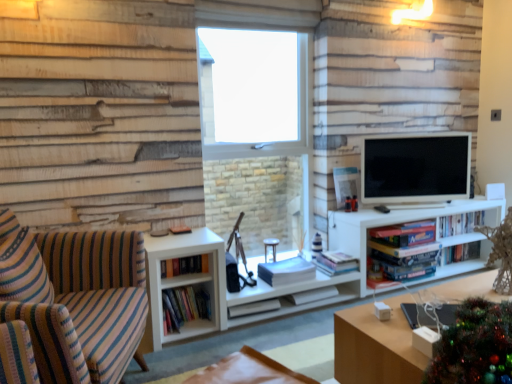
Question: Is hardcover books at center, which appears as the 1th book when viewed from the left, looking in the opposite direction of wooden table at lower right?

Choices:
 (A) yes
 (B) no

Answer: (B)

Question: Does hardcover books at center, which appears as the ninth book when viewed from the right, contain wooden table at lower right?

Choices:
 (A) yes
 (B) no

Answer: (B)

Question: Can you confirm if hardcover books at center, which appears as the ninth book when viewed from the right, is shorter than wooden table at lower right?

Choices:
 (A) no
 (B) yes

Answer: (B)

Question: From a real-world perspective, is hardcover books at center, which appears as the ninth book when viewed from the right, on wooden table at lower right?

Choices:
 (A) yes
 (B) no

Answer: (A)

Question: Can you confirm if hardcover books at center, which appears as the 1th book when viewed from the left, is taller than wooden table at lower right?

Choices:
 (A) no
 (B) yes

Answer: (A)

Question: Is hardcover books at center, which appears as the ninth book when viewed from the right, bigger than wooden table at lower right?

Choices:
 (A) yes
 (B) no

Answer: (B)

Question: Considering the relative sizes of striped fabric couch at left and white matte book at center, the 4th book viewed from the left, in the image provided, is striped fabric couch at left shorter than white matte book at center, the 4th book viewed from the left,?

Choices:
 (A) no
 (B) yes

Answer: (A)

Question: Could you tell me if striped fabric couch at left is turned towards white matte book at center, which is counted as the sixth book, starting from the right?

Choices:
 (A) yes
 (B) no

Answer: (B)

Question: Is striped fabric couch at left closer to the viewer compared to white matte book at center, which is counted as the sixth book, starting from the right?

Choices:
 (A) no
 (B) yes

Answer: (B)

Question: Is striped fabric couch at left far from white matte book at center, the 4th book viewed from the left?

Choices:
 (A) no
 (B) yes

Answer: (B)

Question: Is white matte book at center, which is counted as the sixth book, starting from the right, at the back of striped fabric couch at left?

Choices:
 (A) yes
 (B) no

Answer: (B)

Question: Is striped fabric couch at left thinner than white matte book at center, which is counted as the sixth book, starting from the right?

Choices:
 (A) yes
 (B) no

Answer: (B)

Question: Does white matte book at center, the seventh book in the right-to-left sequence, lie in front of hardcover books at center, which appears as the 3th book when viewed from the right?

Choices:
 (A) no
 (B) yes

Answer: (B)